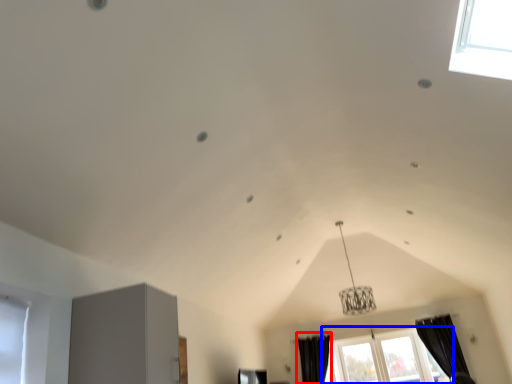
Question: Which object appears closest to the camera in this image, curtain (highlighted by a red box) or window (highlighted by a blue box)?

Choices:
 (A) curtain
 (B) window

Answer: (B)